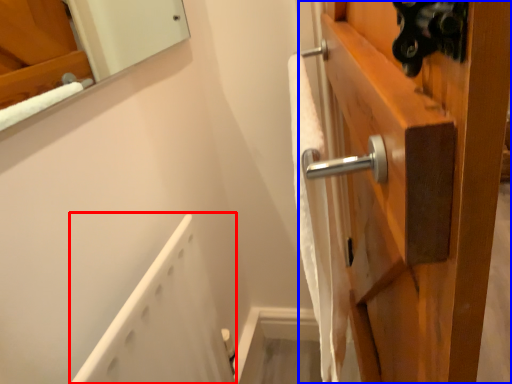
Question: Which point is further to the camera, bath (highlighted by a red box) or door (highlighted by a blue box)?

Choices:
 (A) bath
 (B) door

Answer: (B)